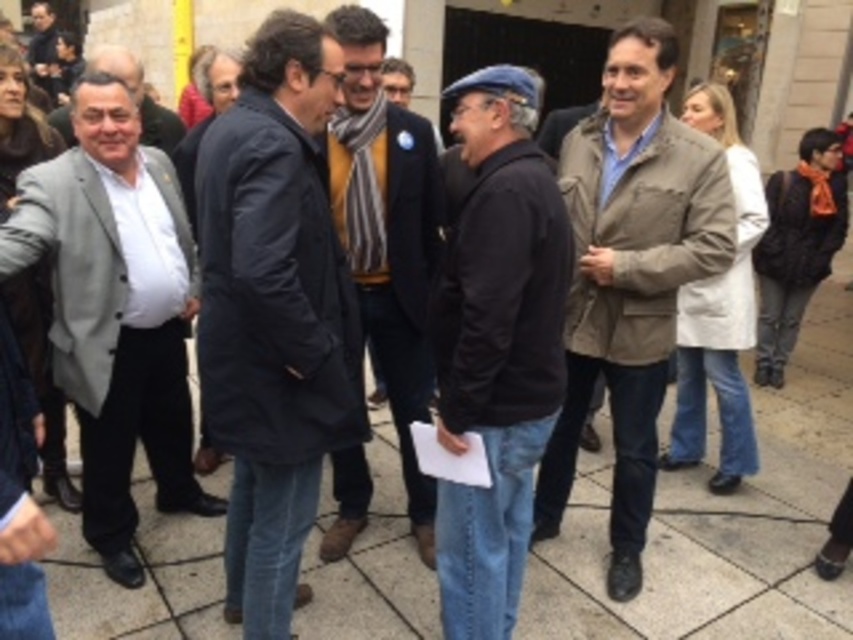
Question: Which object appears farthest from the camera in this image?

Choices:
 (A) dark blue coat at center
 (B) matte gray suit at left

Answer: (B)

Question: Which point is closer to the camera?

Choices:
 (A) (172, 221)
 (B) (62, 122)
 (C) (248, 534)
 (D) (729, 200)

Answer: (C)

Question: From the image, what is the correct spatial relationship of dark blue coat at center in relation to tan leather jacket at center?

Choices:
 (A) left
 (B) right

Answer: (A)

Question: Can you confirm if matte gray blazer at left is positioned to the left of dark blue sweater at center?

Choices:
 (A) no
 (B) yes

Answer: (B)

Question: Is dark blue sweater at center further to camera compared to matte gray suit at left?

Choices:
 (A) yes
 (B) no

Answer: (B)

Question: Which object appears closest to the camera in this image?

Choices:
 (A) matte gray blazer at left
 (B) matte gray suit at left

Answer: (A)